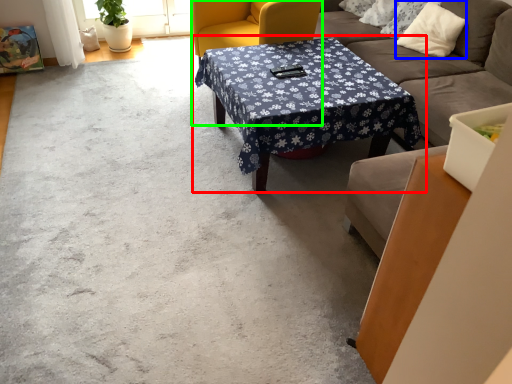
Question: Based on their relative distances, which object is farther from coffee table (highlighted by a red box)? Choose from pillow (highlighted by a blue box) and swivel chair (highlighted by a green box).

Choices:
 (A) pillow
 (B) swivel chair

Answer: (A)